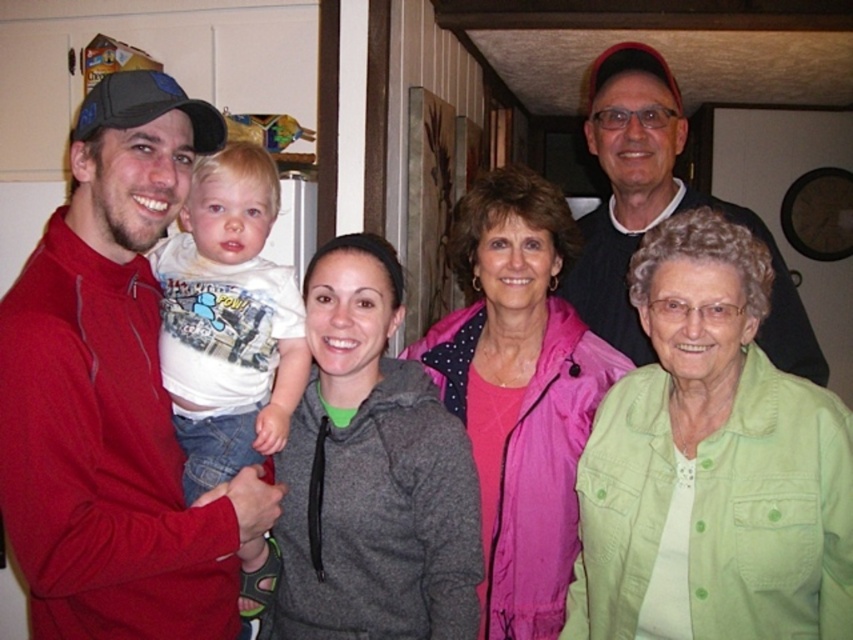
Does matte red jacket at left have a greater width compared to green button-down shirt at lower right?

Yes, matte red jacket at left is wider than green button-down shirt at lower right.

Is matte red jacket at left positioned in front of green button-down shirt at lower right?

Yes, it is.

Describe the element at coordinates (113, 394) in the screenshot. I see `matte red jacket at left` at that location.

Locate an element on the screen. The image size is (853, 640). matte red jacket at left is located at coordinates (113, 394).

Which is in front, point (0, 324) or point (605, 212)?

Point (0, 324) is in front.

Does matte red jacket at left have a greater height compared to matte black shirt at upper right?

Yes.

This screenshot has height=640, width=853. I want to click on matte red jacket at left, so click(113, 394).

Between matte red jacket at left and white cotton shirt at center, which one is positioned lower?

matte red jacket at left is below.

Measure the distance between point (122, 454) and camera.

Point (122, 454) is 4.21 feet away from camera.

Where is `matte red jacket at left`? Image resolution: width=853 pixels, height=640 pixels. matte red jacket at left is located at coordinates (113, 394).